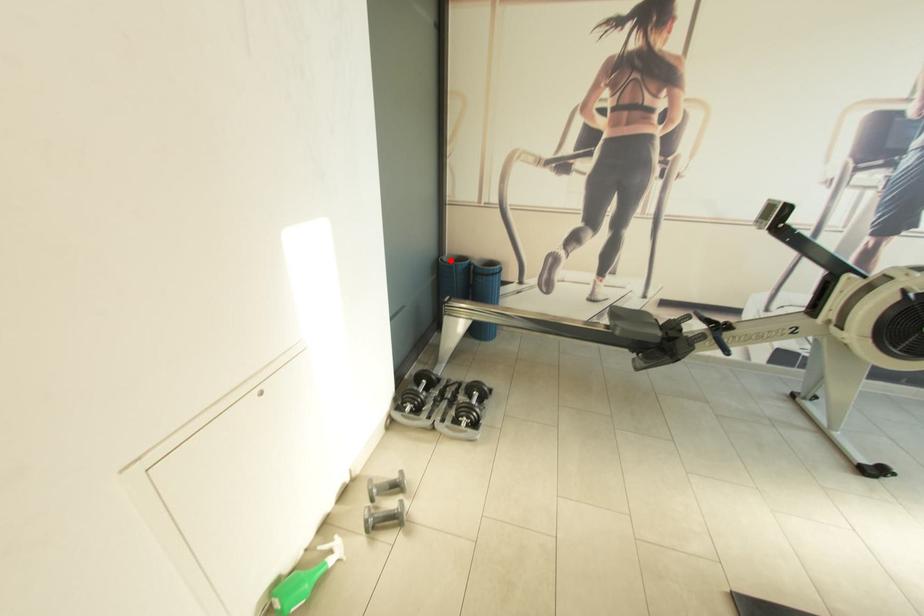
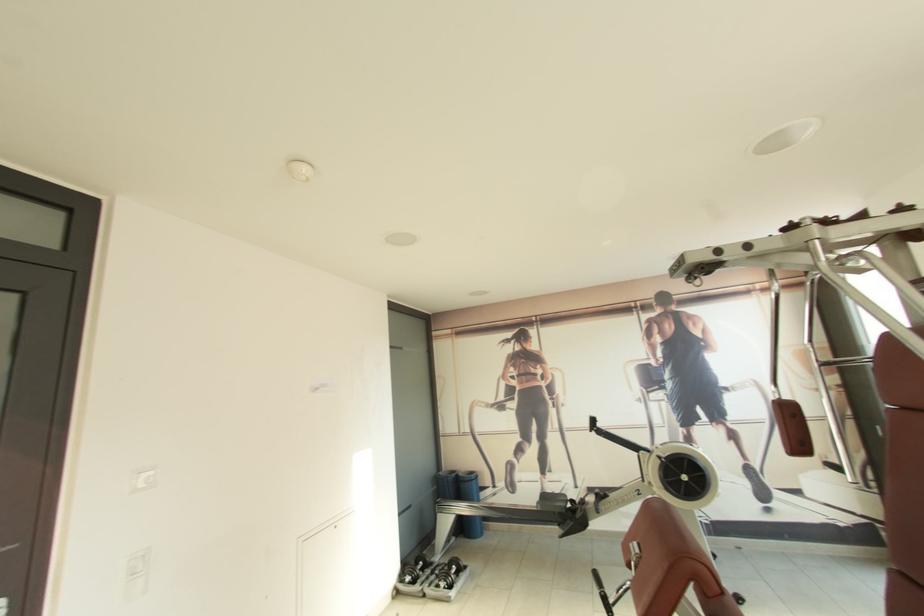
Question: I am providing you with two images of the same scene from different viewpoints. In image1, a red point is highlighted. Considering the same 3D point in image2, which of the following is correct?

Choices:
 (A) It is closer
 (B) It is farther

Answer: (B)